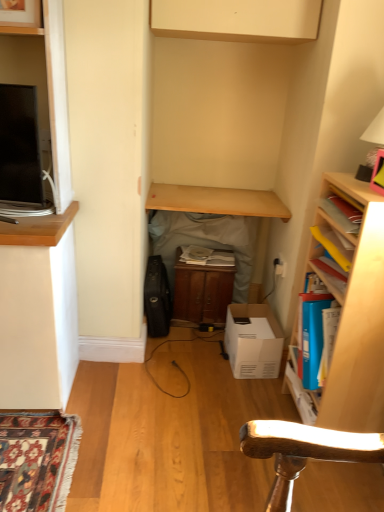
The image size is (384, 512). In order to click on free space to the left of white cardboard box at center in this screenshot , I will do coord(203,359).